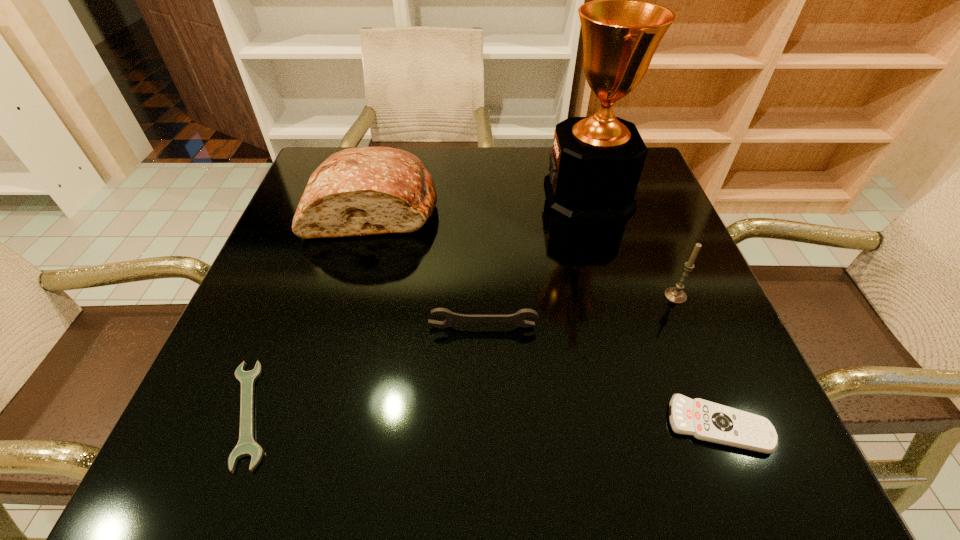
Locate an element on the screen. This screenshot has width=960, height=540. bread present at the left edge is located at coordinates (359, 191).

Find the location of `wrench situated at the left edge`. wrench situated at the left edge is located at coordinates (246, 446).

At what (x,y) coordinates should I click in order to perform the action: click on trophy cup at the right edge. Please return your answer as a coordinate pair (x, y). This screenshot has width=960, height=540. Looking at the image, I should click on (596, 162).

Identify the location of candle at the right edge. The width and height of the screenshot is (960, 540). (675, 294).

The height and width of the screenshot is (540, 960). In order to click on remote control situated at the right edge in this screenshot , I will do `click(704, 420)`.

Locate an element on the screen. The image size is (960, 540). object present at the far left corner is located at coordinates (359, 191).

Find the location of `object positioned at the near left corner`. object positioned at the near left corner is located at coordinates (246, 446).

Find the location of a particular element. The height and width of the screenshot is (540, 960). object that is at the far right corner is located at coordinates click(596, 162).

Find the location of `object that is at the near right corner`. object that is at the near right corner is located at coordinates (704, 420).

Where is `vacant space at the far edge of the desktop`? vacant space at the far edge of the desktop is located at coordinates (x=422, y=159).